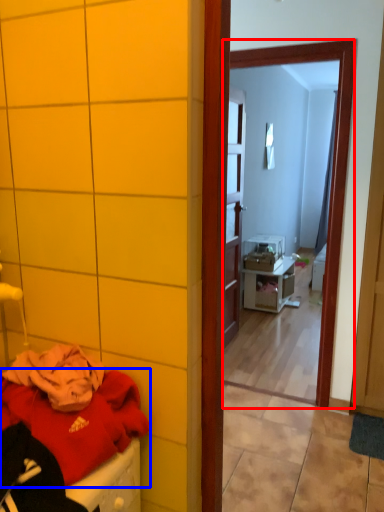
Question: Which object appears closest to the camera in this image, mirror (highlighted by a red box) or clothing (highlighted by a blue box)?

Choices:
 (A) mirror
 (B) clothing

Answer: (B)